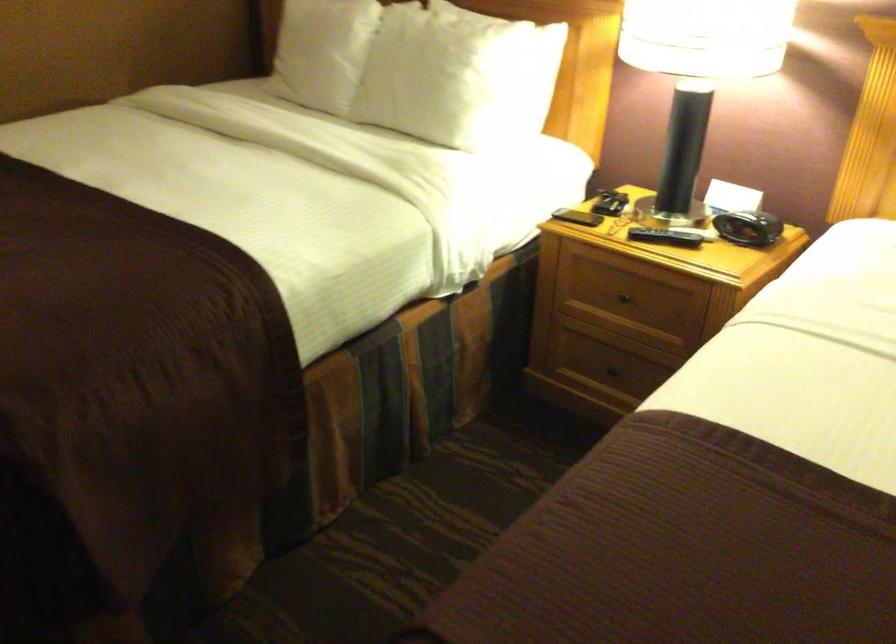
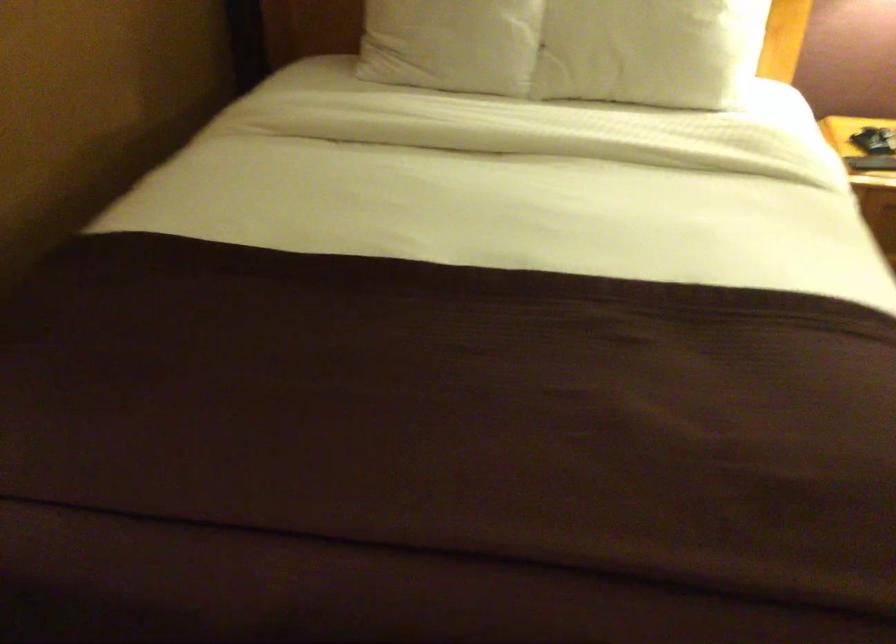
The point at (298, 69) is marked in the first image. Where is the corresponding point in the second image?

(452, 44)